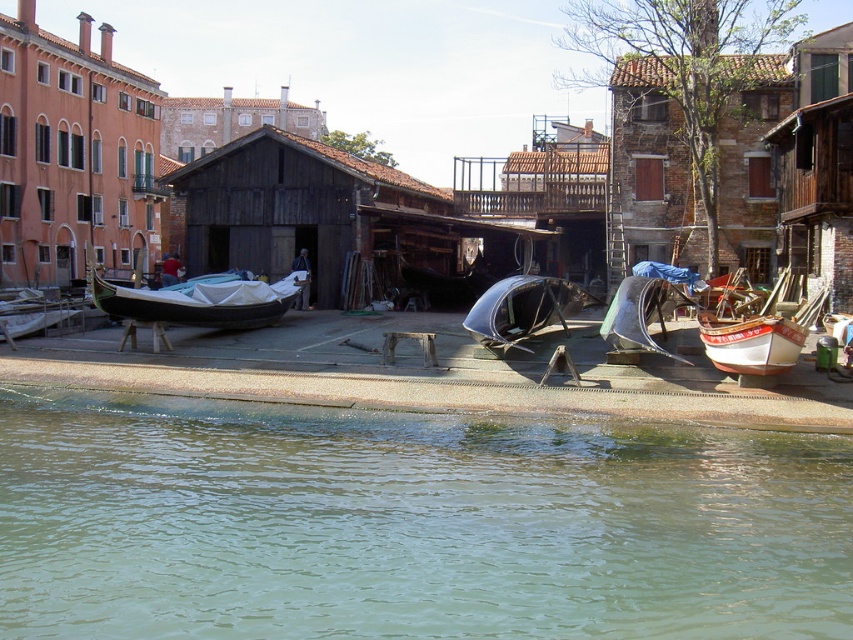
You are a tourist standing on the dock and want to take a photo of the matte orange building at upper left and the black polished wood boat at left. Which object will appear larger in your photo?

The matte orange building at upper left will appear larger in the photo because it is closer to the viewer than the black polished wood boat at left.

You are planning to take a photo of the matte orange building at upper left and the black polished wood boat at left from a position where both are in frame. Which object requires more horizontal space in the camera frame to fully capture its width?

The matte orange building at upper left requires more horizontal space in the camera frame because its width is larger than the black polished wood boat at left.

You are a tourist standing on the dock and want to take a photo of the brown rustic hut at center and the matte orange building at upper left. Which object will appear closer to you in the photo?

The matte orange building at upper left will appear closer to you in the photo because the brown rustic hut at center is behind it.